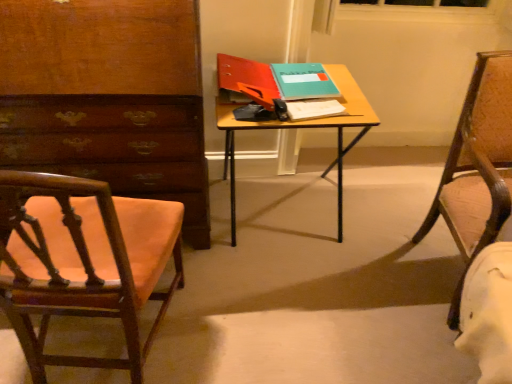
This screenshot has height=384, width=512. Identify the location of free region on the left part of leather-like brown chair at right, which is the second chair from left to right. (379, 274).